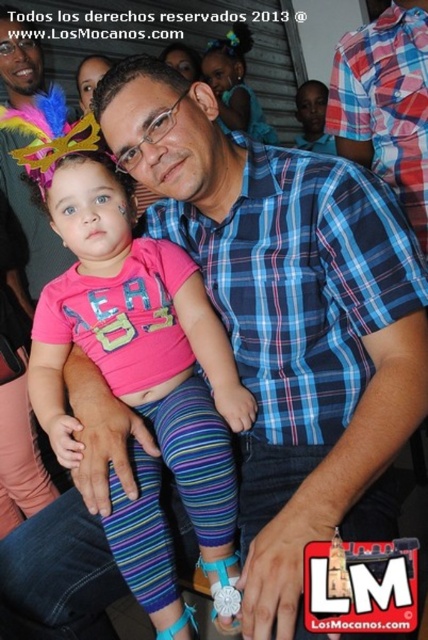
Question: Considering the relative positions of blue plaid shirt at center and pink fabric dress at center in the image provided, where is blue plaid shirt at center located with respect to pink fabric dress at center?

Choices:
 (A) right
 (B) left

Answer: (A)

Question: Estimate the real-world distances between objects in this image. Which object is closer to the pink fabric dress at center?

Choices:
 (A) blue plaid shirt at center
 (B) pink fabric shirt at center

Answer: (A)

Question: Is blue plaid shirt at center positioned before pink fabric dress at center?

Choices:
 (A) no
 (B) yes

Answer: (B)

Question: Which object is closer to the camera taking this photo?

Choices:
 (A) blue plaid shirt at center
 (B) pink fabric shirt at center

Answer: (B)

Question: Which is nearer to the blue plaid shirt at center?

Choices:
 (A) pink fabric shirt at center
 (B) pink fabric dress at center

Answer: (A)

Question: Does pink fabric shirt at center appear on the right side of blue plaid shirt at center?

Choices:
 (A) no
 (B) yes

Answer: (A)